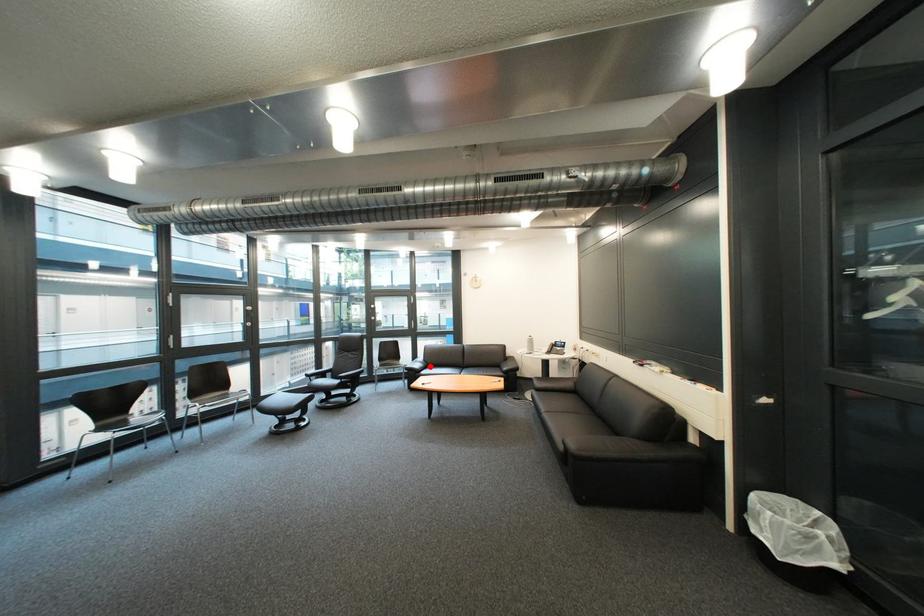
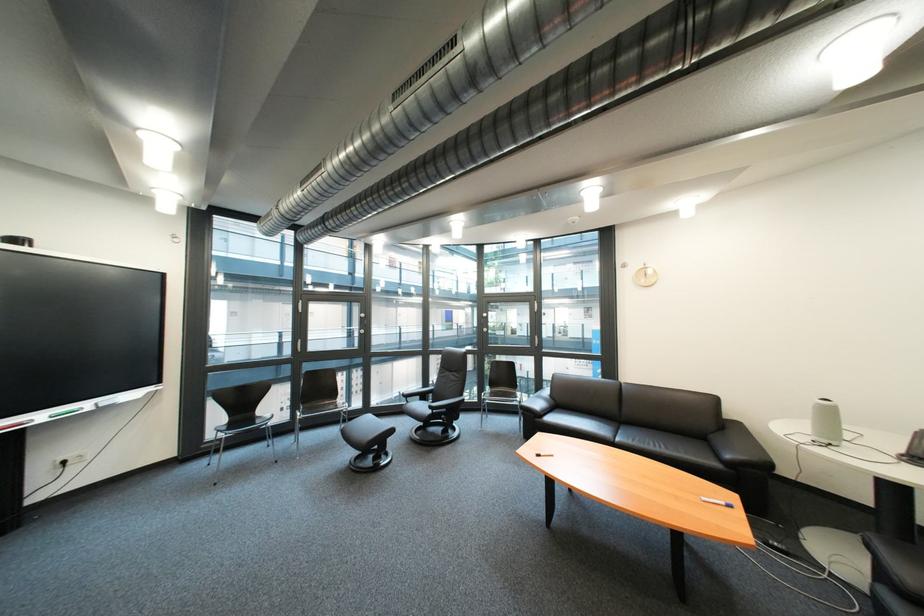
Question: I am providing you with two images of the same scene from different viewpoints. Image1 has a red point marked. In image2, the corresponding 3D location appears at what relative position? Reply with the corresponding letter.

Choices:
 (A) Closer
 (B) Farther

Answer: (A)